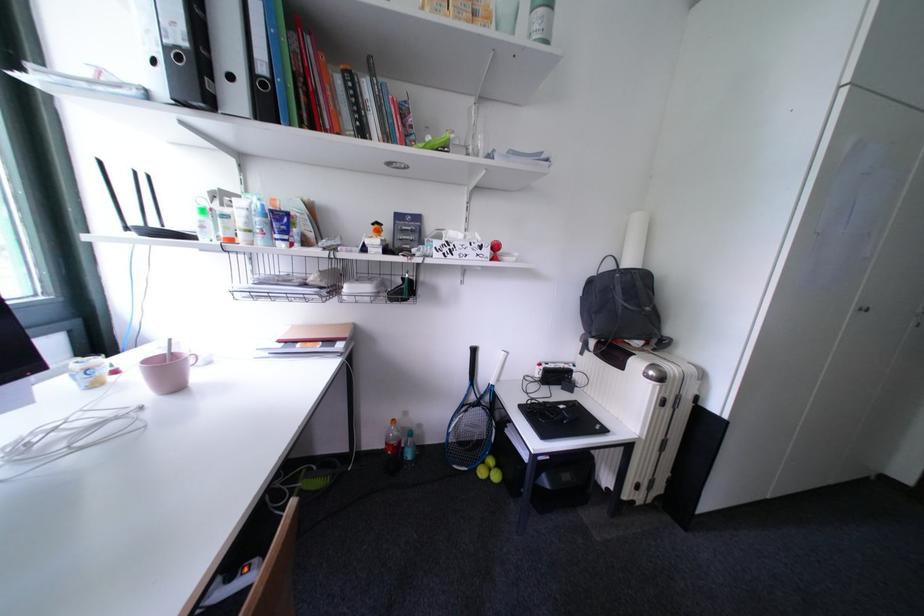
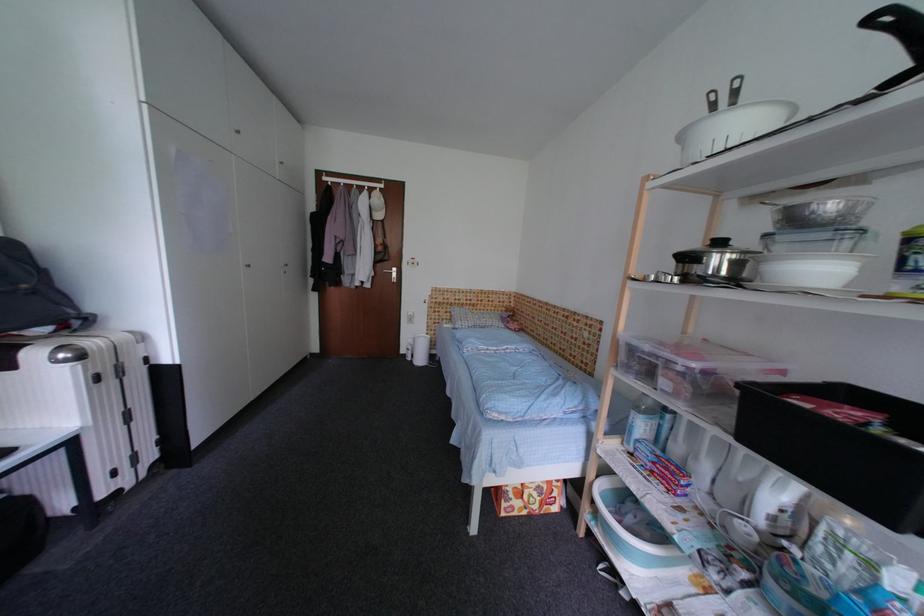
Question: The images are taken continuously from a first-person perspective. In which direction is your viewpoint rotating?

Choices:
 (A) Left
 (B) Right
 (C) Up
 (D) Down

Answer: (B)